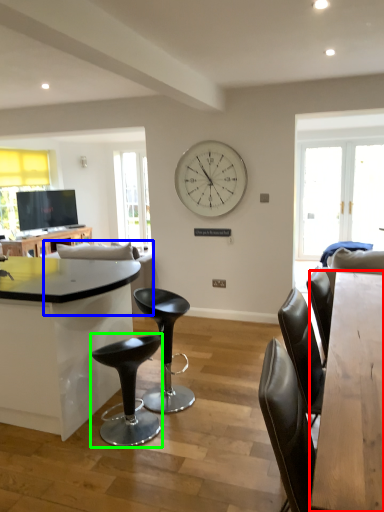
Question: Based on their relative distances, which object is nearer to table (highlighted by a red box)? Choose from couch (highlighted by a blue box) and bar stool (highlighted by a green box).

Choices:
 (A) couch
 (B) bar stool

Answer: (B)